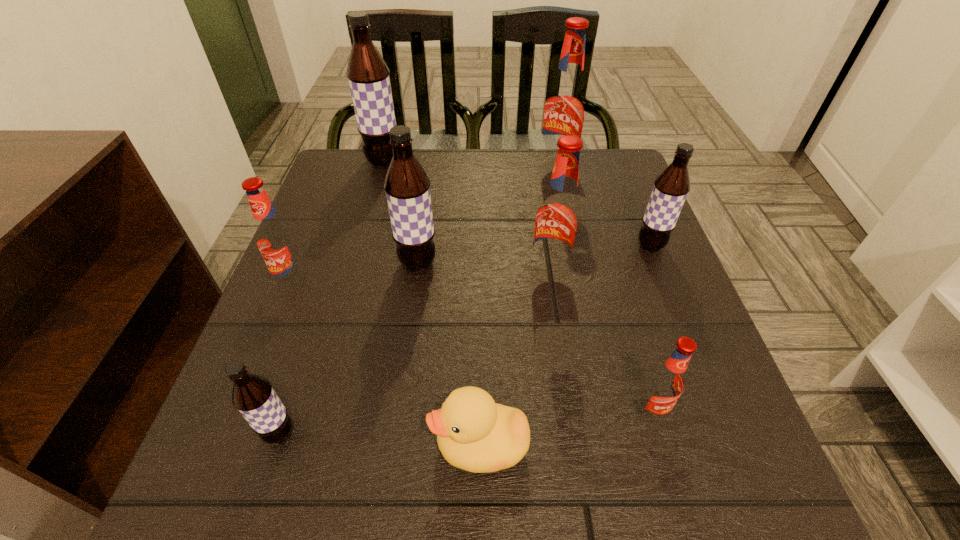
Identify the location of the nearest brown root beer. The image size is (960, 540). (254, 397).

Locate an element on the screen. Image resolution: width=960 pixels, height=540 pixels. duck is located at coordinates pyautogui.click(x=474, y=433).

Identify the location of the fifth object from right to left. The width and height of the screenshot is (960, 540). (474, 433).

Find the location of a particular element. This screenshot has height=540, width=960. vacant region located 0.150m on the right of the farthest brown root beer is located at coordinates (457, 161).

Find the location of a particular element. Image resolution: width=960 pixels, height=540 pixels. vacant space located 0.300m on the left of the farthest red root beer is located at coordinates (425, 168).

Where is `free location located 0.080m on the front of the sixth object from right to left`? The height and width of the screenshot is (540, 960). free location located 0.080m on the front of the sixth object from right to left is located at coordinates (412, 308).

Image resolution: width=960 pixels, height=540 pixels. I want to click on vacant space located 0.080m on the back of the third smallest red root beer, so click(544, 235).

In order to click on free space located 0.180m on the back of the second smallest red root beer in this screenshot , I will do `click(321, 217)`.

Where is `blank area located on the front of the rightmost object`? Image resolution: width=960 pixels, height=540 pixels. blank area located on the front of the rightmost object is located at coordinates (662, 277).

Locate an element on the screen. The height and width of the screenshot is (540, 960). free space located 0.290m on the left of the nearest red root beer is located at coordinates (449, 411).